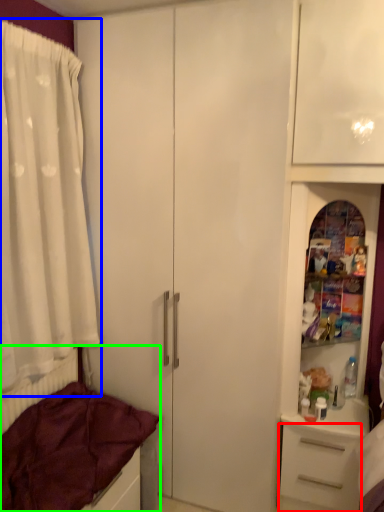
Question: Which is nearer to the drawer (highlighted by a red box)? curtain (highlighted by a blue box) or bed (highlighted by a green box).

Choices:
 (A) curtain
 (B) bed

Answer: (B)